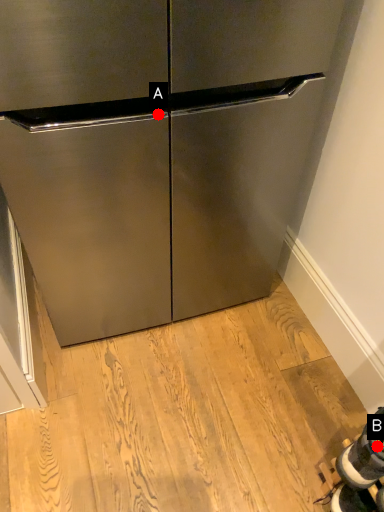
Question: Two points are circled on the image, labeled by A and B beside each circle. Which point is closer to the camera taking this photo?

Choices:
 (A) A is closer
 (B) B is closer

Answer: (B)